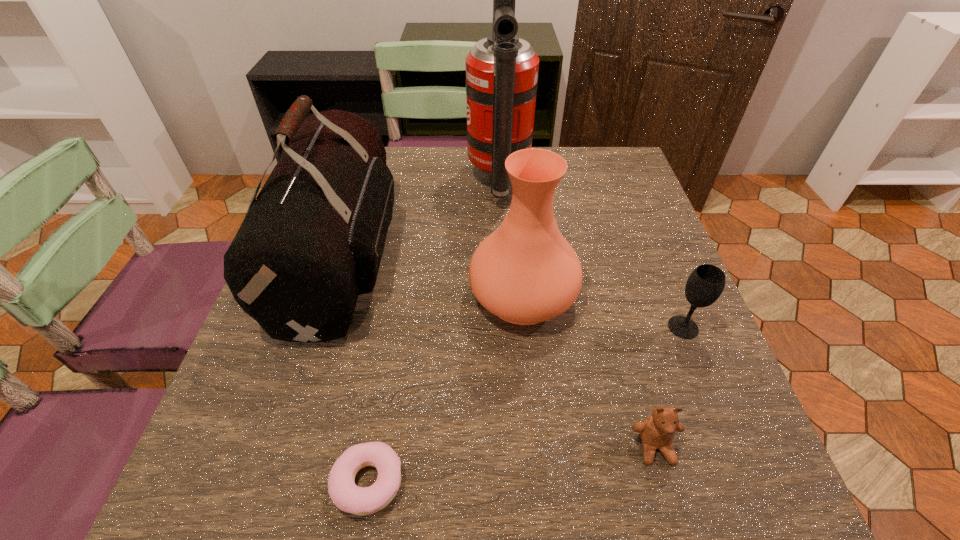
Where is `free space between the vase and the doughnut`? The height and width of the screenshot is (540, 960). free space between the vase and the doughnut is located at coordinates (445, 389).

You are a GUI agent. You are given a task and a screenshot of the screen. Output one action in this format:
    pyautogui.click(x=<x>, y=<y>)
    Task: Click on the vacant space that is in between the rightmost object and the vase
    This screenshot has width=960, height=540.
    Given the screenshot: What is the action you would take?
    pyautogui.click(x=603, y=312)

Locate an element on the screen. This screenshot has width=960, height=540. empty space between the shortest object and the vase is located at coordinates coord(445,389).

Locate an element on the screen. free area in between the duffel bag and the second object from right to left is located at coordinates (498, 352).

What are the coordinates of `free area in between the vase and the duffel bag` in the screenshot? It's located at (433, 276).

You are a GUI agent. You are given a task and a screenshot of the screen. Output one action in this format:
    pyautogui.click(x=<x>, y=<y>)
    Task: Click on the vacant point located between the shortest object and the vase
    This screenshot has height=540, width=960.
    Given the screenshot: What is the action you would take?
    pyautogui.click(x=445, y=389)

Where is `the third closest object relative to the third shortest object`? Image resolution: width=960 pixels, height=540 pixels. the third closest object relative to the third shortest object is located at coordinates (502, 70).

Select which object appears as the fourth closest to the rightmost object. Please provide its 2D coordinates. Your answer should be formatted as a tuple, i.e. [(x, y)], where the tuple contains the x and y coordinates of a point satisfying the conditions above.

[(346, 495)]

I want to click on free region that satisfies the following two spatial constraints: 1. on the front label side of the tallest object; 2. on the right side of the third shortest object, so click(x=506, y=327).

You are a GUI agent. You are given a task and a screenshot of the screen. Output one action in this format:
    pyautogui.click(x=<x>, y=<y>)
    Task: Click on the free spot that satisfies the following two spatial constraints: 1. on the front side of the wineglass; 2. on the left side of the vase
    This screenshot has height=540, width=960.
    Given the screenshot: What is the action you would take?
    pyautogui.click(x=526, y=327)